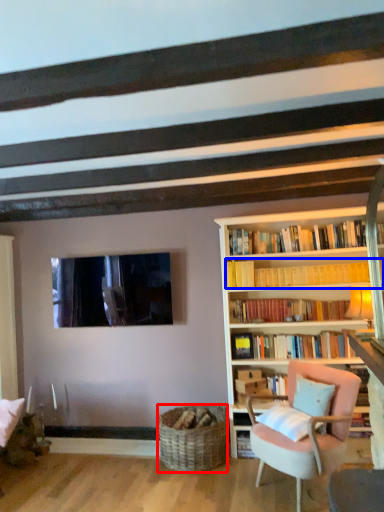
Question: Which of the following is the closest to the observer, basket (highlighted by a red box) or book (highlighted by a blue box)?

Choices:
 (A) basket
 (B) book

Answer: (A)